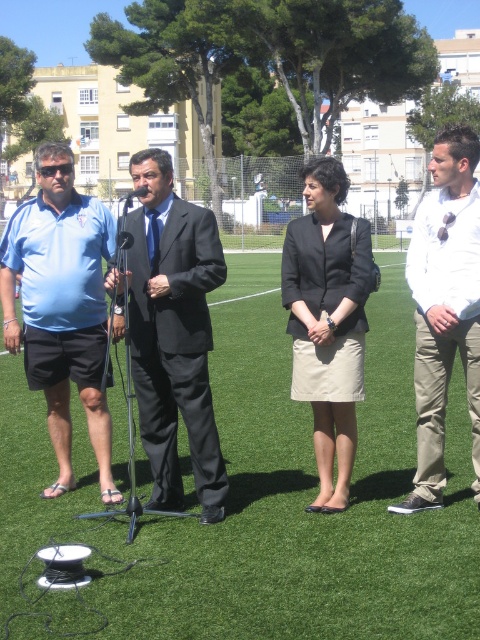
You are standing at the origin point of the coordinate system. You want to walk to the dark gray blazer at center. Which direction should you move in?

The dark gray blazer at center is located at coordinate point 0.502 in the x direction and 0.683 in the y direction. Since the coordinate system is likely set with the origin at the bottom left corner, moving towards positive x would mean to the right and positive y upwards. Therefore, to reach the dark gray blazer at center, you should move to the right and upwards from the origin.

You are a photographer setting up for an outdoor event and need to position a 1.5m tall tripod. You see the green artificial turf at lower center and the white cotton shirt at right. Which object is shorter, allowing the tripod to be placed without blocking the view of the white cotton shirt?

The green artificial turf at lower center is shorter than the white cotton shirt at right, so placing the tripod there would not block the view of the white cotton shirt.

You are standing at the edge of the field and see the green artificial turf at lower center and the white cotton shirt at right. Which object is closer to your left side?

The green artificial turf at lower center is to the left of the white cotton shirt at right, so it is closer to your left side.